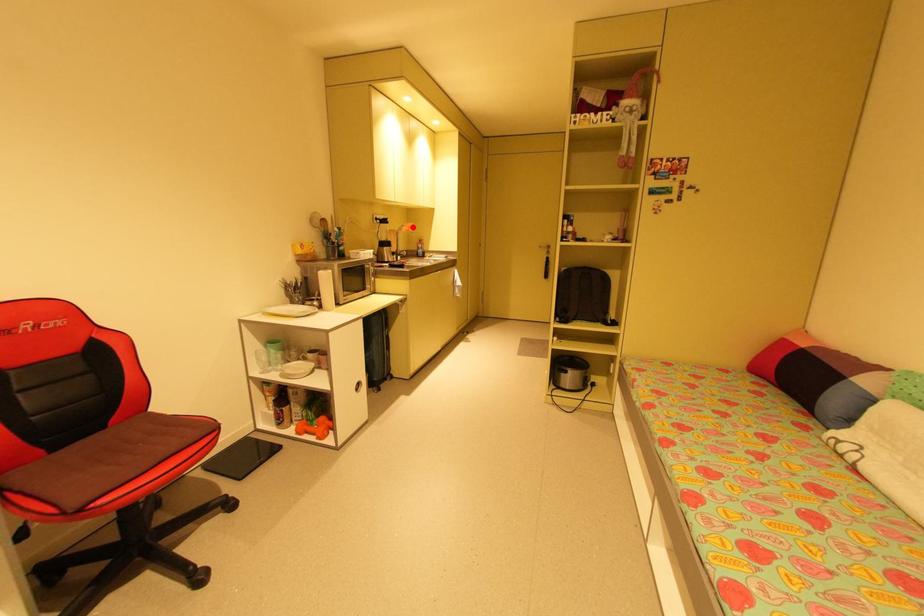
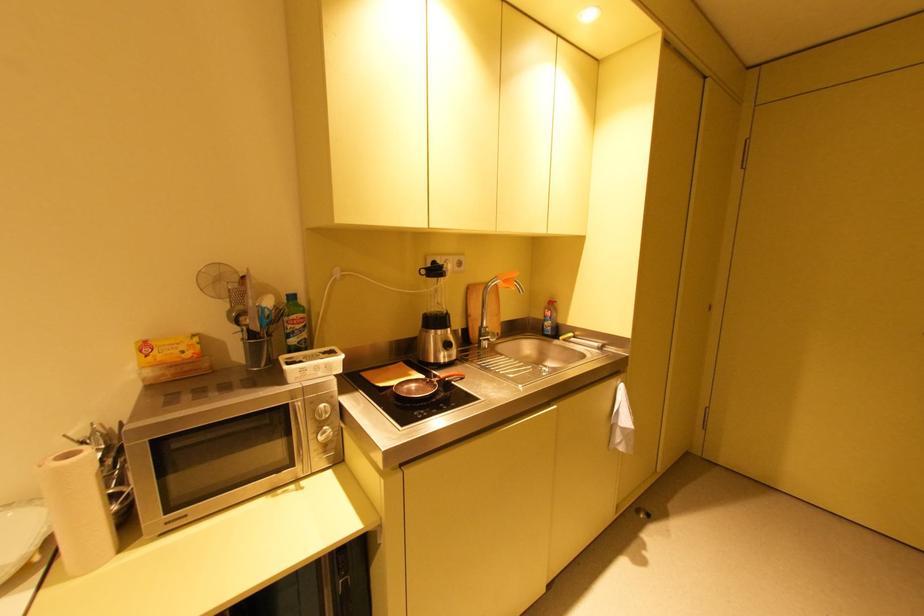
The point at the highlighted location is marked in the first image. Where is the corresponding point in the second image?

(508, 282)